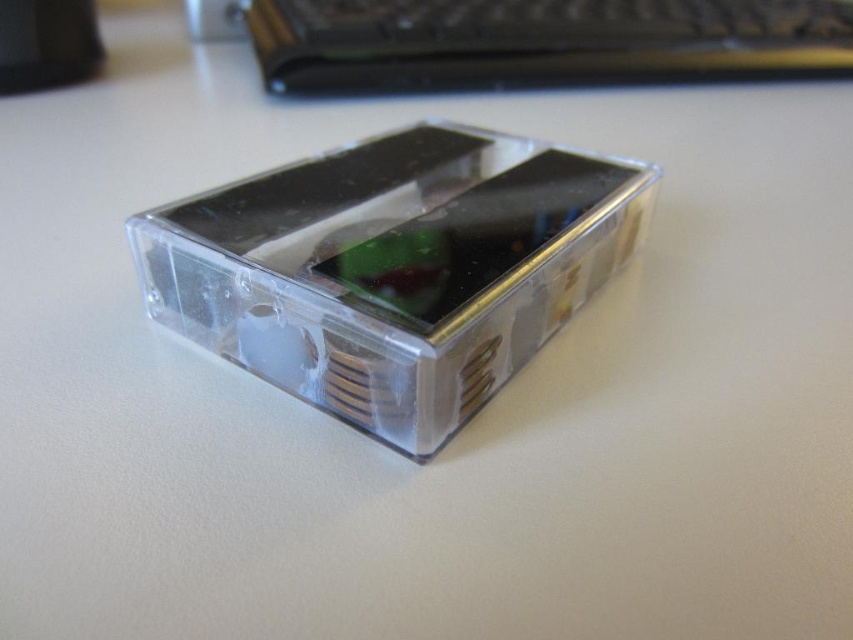
Question: Does transparent plastic smartphone at center appear under clear plastic computer at center?

Choices:
 (A) yes
 (B) no

Answer: (A)

Question: In this image, where is transparent plastic smartphone at center located relative to clear plastic computer at center?

Choices:
 (A) below
 (B) above

Answer: (A)

Question: Can you confirm if transparent plastic smartphone at center is positioned to the right of clear plastic computer at center?

Choices:
 (A) yes
 (B) no

Answer: (B)